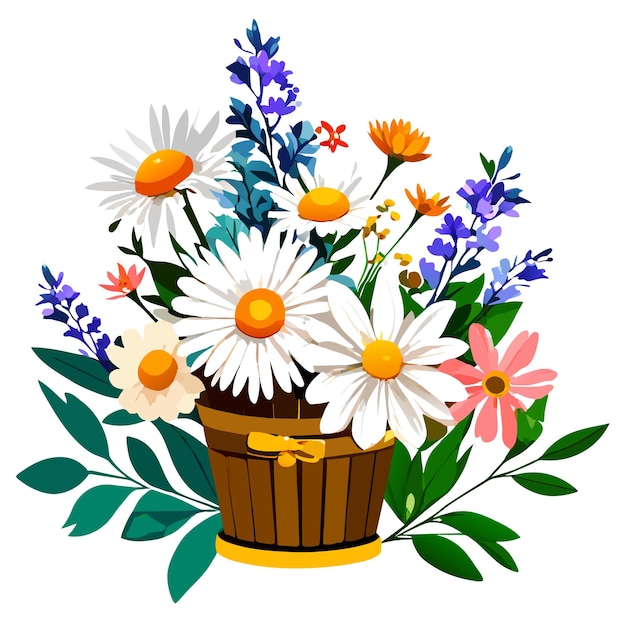
At what (x,y) coordinates should I click in order to perform the action: click on horizontal wood at top of basket. Please return your answer as a coordinate pair (x, y). The width and height of the screenshot is (626, 626). Looking at the image, I should click on (226, 416), (228, 439).